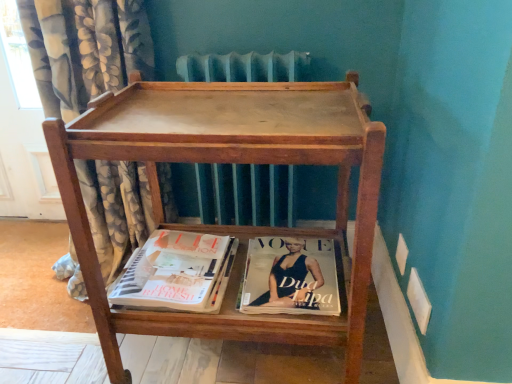
Question: Does matte paper magazine at lower center have a lesser width compared to matte paper magazine at lower center?

Choices:
 (A) no
 (B) yes

Answer: (A)

Question: Is matte paper magazine at lower center taller than matte paper magazine at lower center?

Choices:
 (A) yes
 (B) no

Answer: (B)

Question: Is matte paper magazine at lower center smaller than matte paper magazine at lower center?

Choices:
 (A) yes
 (B) no

Answer: (A)

Question: Considering the relative sizes of matte paper magazine at lower center and matte paper magazine at lower center in the image provided, is matte paper magazine at lower center wider than matte paper magazine at lower center?

Choices:
 (A) no
 (B) yes

Answer: (B)

Question: Is matte paper magazine at lower center inside matte paper magazine at lower center?

Choices:
 (A) no
 (B) yes

Answer: (A)

Question: Does matte paper magazine at lower center appear on the left side of matte paper magazine at lower center?

Choices:
 (A) yes
 (B) no

Answer: (A)

Question: Considering the relative sizes of matte paper magazine at lower center and wooden tray at center in the image provided, is matte paper magazine at lower center shorter than wooden tray at center?

Choices:
 (A) yes
 (B) no

Answer: (A)

Question: Can you confirm if matte paper magazine at lower center is bigger than wooden tray at center?

Choices:
 (A) yes
 (B) no

Answer: (B)

Question: From a real-world perspective, is matte paper magazine at lower center positioned under wooden tray at center based on gravity?

Choices:
 (A) yes
 (B) no

Answer: (A)

Question: Is matte paper magazine at lower center to the right of wooden tray at center from the viewer's perspective?

Choices:
 (A) yes
 (B) no

Answer: (A)

Question: Is matte paper magazine at lower center to the left of wooden tray at center from the viewer's perspective?

Choices:
 (A) no
 (B) yes

Answer: (A)

Question: Does matte paper magazine at lower center have a smaller size compared to wooden tray at center?

Choices:
 (A) yes
 (B) no

Answer: (A)

Question: Considering the relative sizes of matte paper magazine at lower center and floral fabric curtain at left in the image provided, is matte paper magazine at lower center bigger than floral fabric curtain at left?

Choices:
 (A) no
 (B) yes

Answer: (A)